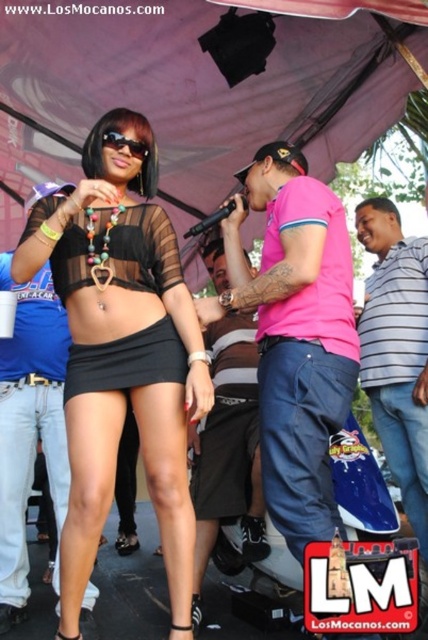
Looking at this image, you are a photographer at the event and want to capture a photo that includes both the pink fabric shirt at center and the black matte skirt at center. Which object should you position to your left to ensure both are in frame?

To include both the pink fabric shirt at center and the black matte skirt at center in the photo, position the black matte skirt at center to your left since the pink fabric shirt at center is to the right of it.

You are an event photographer at the lively outdoor event under the large purple canopy. You need to capture a photo of the woman wearing the black sheer top at center and black matte skirt at center. Can you tell me which piece of clothing is positioned higher on her body?

The black sheer top at center is above the black matte skirt at center, so the black sheer top at center is positioned higher on her body.

You are a photographer at the event and need to frame a shot that includes both the pink fabric shirt at center and the black mesh skirt at center. Which object should you adjust your focus to capture first if you want to ensure the wider one is in frame?

The pink fabric shirt at center is wider than the black mesh skirt at center. Therefore, you should first focus on capturing the pink fabric shirt at center to ensure its full width is in frame.